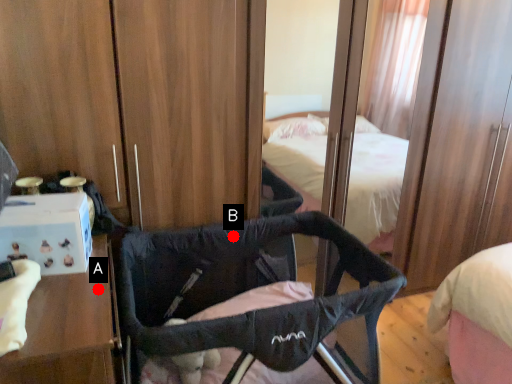
Question: Two points are circled on the image, labeled by A and B beside each circle. Among these points, which one is farthest from the camera?

Choices:
 (A) A is further
 (B) B is further

Answer: (B)